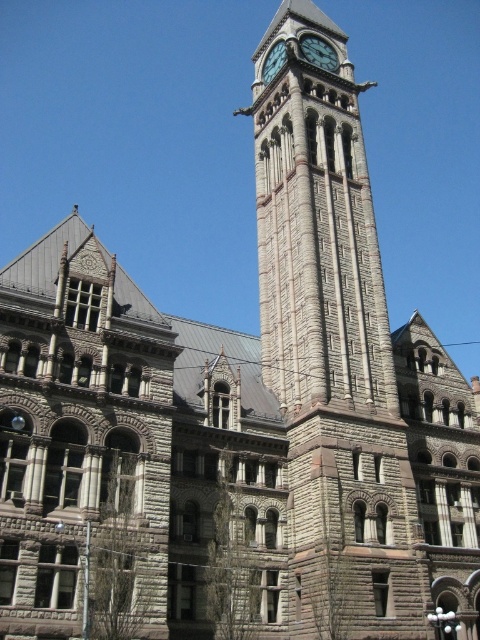
Question: Which object appears closest to the camera in this image?

Choices:
 (A) greenish-gray stone clock at upper center
 (B) stone clock tower at center
 (C) brick clock tower at upper center

Answer: (B)

Question: Which point is farther to the camera?

Choices:
 (A) greenish-gray stone clock at upper center
 (B) brick clock tower at upper center
 (C) stone clock tower at center

Answer: (A)

Question: Can you confirm if stone clock tower at center is thinner than greenish-gray stone clock at upper center?

Choices:
 (A) no
 (B) yes

Answer: (A)

Question: Based on their relative distances, which object is nearer to the greenish-gray stone clock at upper center?

Choices:
 (A) stone clock tower at center
 (B) brick clock tower at upper center

Answer: (B)

Question: Can you confirm if stone clock tower at center is positioned to the left of brick clock tower at upper center?

Choices:
 (A) no
 (B) yes

Answer: (B)

Question: Is stone clock tower at center thinner than greenish-gray stone clock at upper center?

Choices:
 (A) yes
 (B) no

Answer: (B)